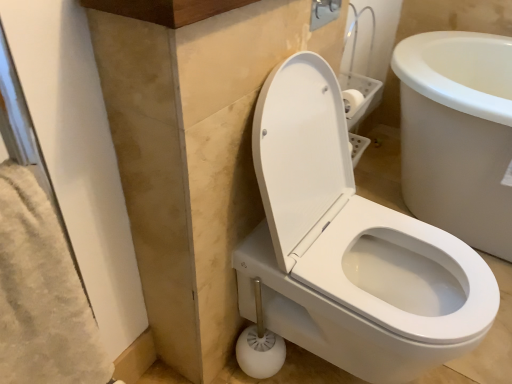
Question: Is white plastic toilet brush at lower center further to camera compared to white glossy toilet at center?

Choices:
 (A) yes
 (B) no

Answer: (A)

Question: Does white plastic toilet brush at lower center have a larger size compared to white glossy toilet at center?

Choices:
 (A) yes
 (B) no

Answer: (B)

Question: Is white plastic toilet brush at lower center shorter than white glossy toilet at center?

Choices:
 (A) no
 (B) yes

Answer: (B)

Question: From the image's perspective, is white plastic toilet brush at lower center above white glossy toilet at center?

Choices:
 (A) yes
 (B) no

Answer: (B)

Question: Is white plastic toilet brush at lower center wider than white glossy toilet at center?

Choices:
 (A) yes
 (B) no

Answer: (B)

Question: Is the surface of white plastic toilet brush at lower center in direct contact with white glossy toilet at center?

Choices:
 (A) no
 (B) yes

Answer: (A)

Question: Is the depth of white glossy toilet at center greater than that of white plastic toilet brush at lower center?

Choices:
 (A) yes
 (B) no

Answer: (B)

Question: Can you confirm if white glossy toilet at center is wider than white plastic toilet brush at lower center?

Choices:
 (A) yes
 (B) no

Answer: (A)

Question: Is white glossy toilet at center not near white plastic toilet brush at lower center?

Choices:
 (A) yes
 (B) no

Answer: (B)

Question: Does white glossy toilet at center have a greater height compared to white plastic toilet brush at lower center?

Choices:
 (A) no
 (B) yes

Answer: (B)

Question: Would you say white glossy toilet at center is outside white plastic toilet brush at lower center?

Choices:
 (A) yes
 (B) no

Answer: (A)

Question: From a real-world perspective, is white glossy toilet at center located beneath white plastic toilet brush at lower center?

Choices:
 (A) no
 (B) yes

Answer: (A)

Question: Considering their positions, is white glossy toilet at center located in front of or behind white plastic toilet brush at lower center?

Choices:
 (A) front
 (B) behind

Answer: (A)